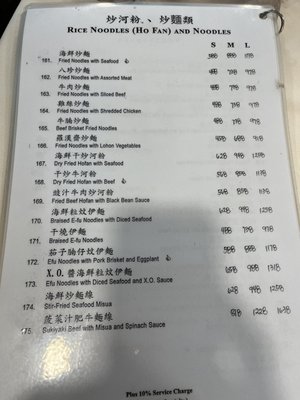
Locate an element on the screen. fan is located at coordinates (161, 30).